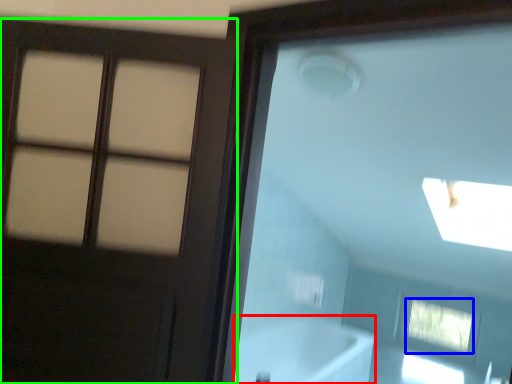
Question: Which object is positioned farthest from bath (highlighted by a red box)? Select from window (highlighted by a blue box) and door (highlighted by a green box).

Choices:
 (A) window
 (B) door

Answer: (B)